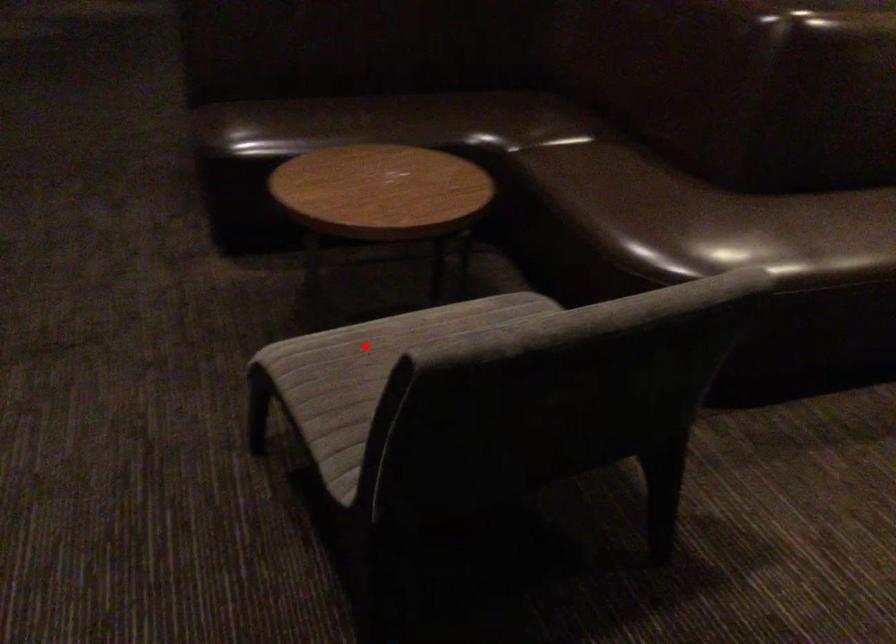
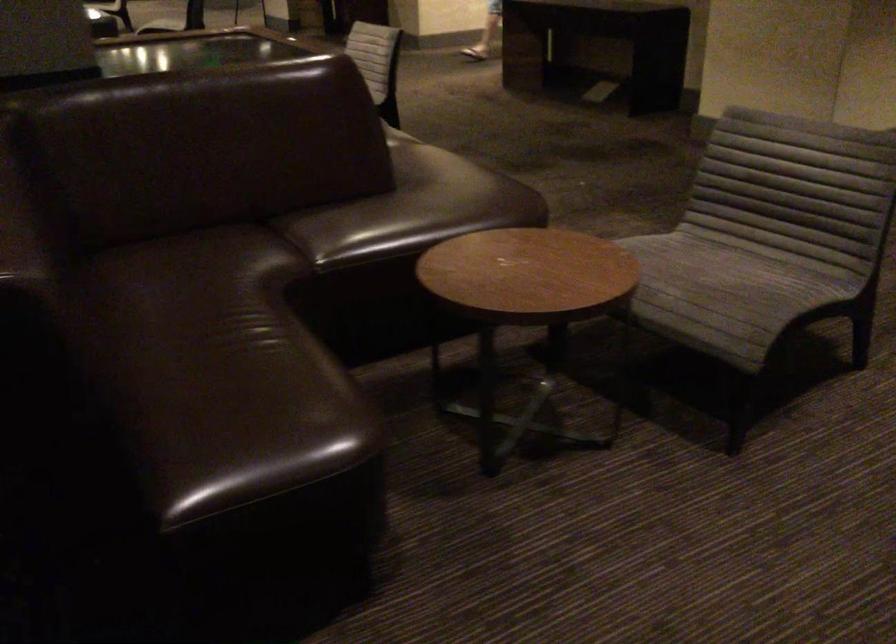
In the second image, find the point that corresponds to the highlighted location in the first image.

(722, 286)